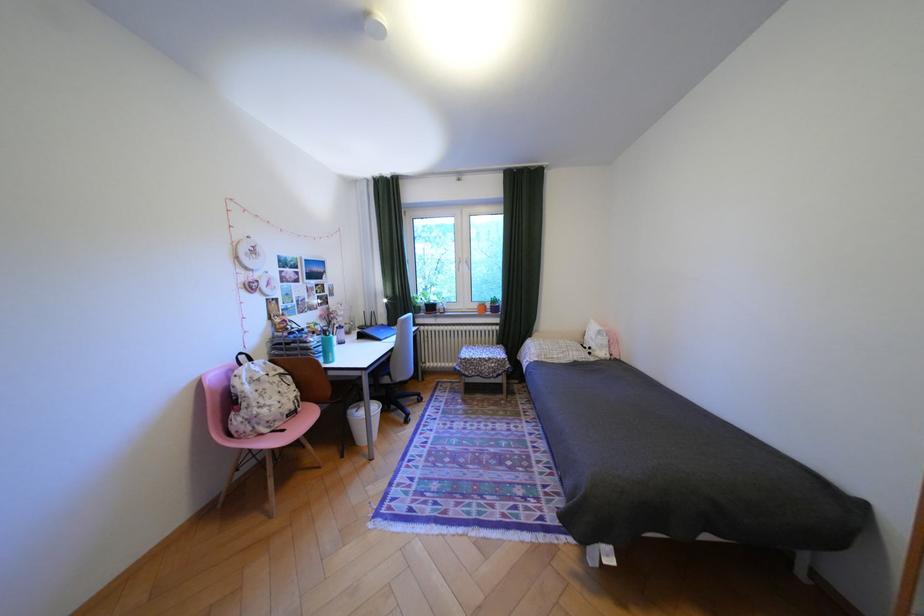
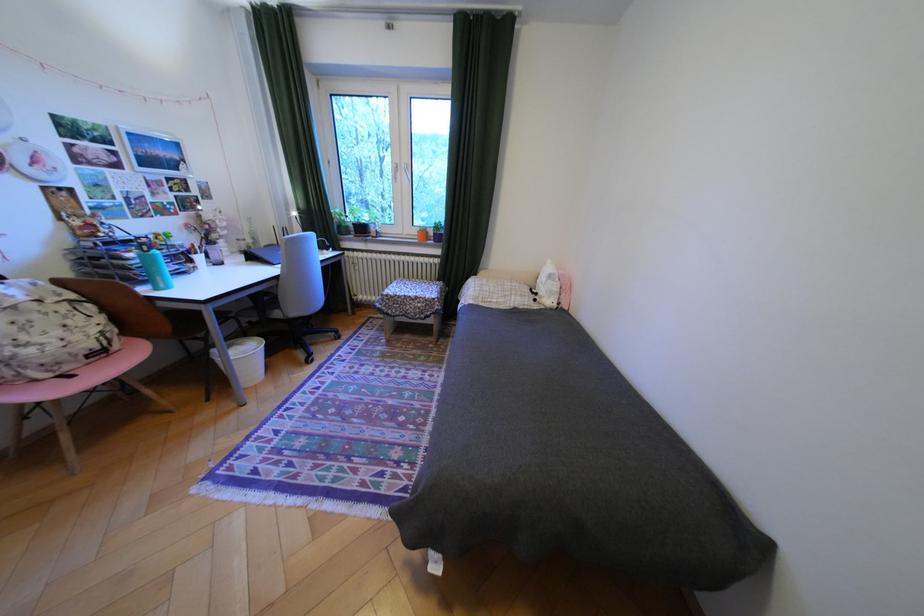
Find the pixel in the second image that matches (602,349) in the first image.

(548, 294)